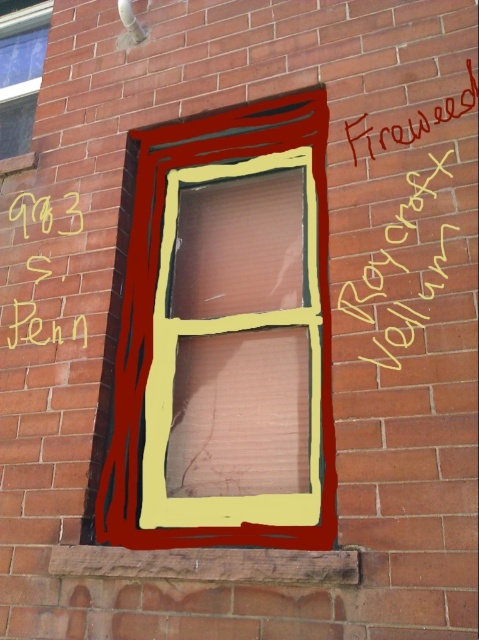
Can you confirm if wooden window frame at center is smaller than matte glass window at upper left?

Actually, wooden window frame at center might be larger than matte glass window at upper left.

Does wooden window frame at center come in front of matte glass window at upper left?

That is True.

This screenshot has width=479, height=640. What are the coordinates of `wooden window frame at center` in the screenshot? It's located at (226, 337).

Who is taller, yellow marker writing at center right or yellow chalk writing at center?

Standing taller between the two is yellow marker writing at center right.

Is point (378, 316) in front of point (78, 198)?

Yes, it is.

Who is more forward, [415,276] or [26,328]?

Positioned in front is point [415,276].

At what (x,y) coordinates should I click in order to perform the action: click on yellow marker writing at center right. Please return your answer as a coordinate pair (x, y). This screenshot has height=640, width=479. Looking at the image, I should click on (401, 272).

Is wooden window frame at center below red painted graffiti at upper right?

Yes.

Which of these two, wooden window frame at center or red painted graffiti at upper right, stands shorter?

Standing shorter between the two is red painted graffiti at upper right.

Is point (206, 262) behind point (387, 147)?

Yes, it is.

Identify the location of wooden window frame at center. (226, 337).